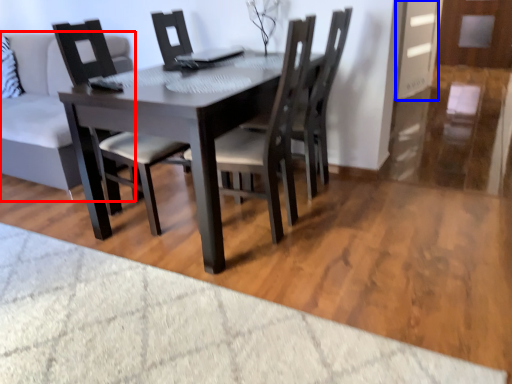
Question: Which of the following is the closest to the observer, studio couch (highlighted by a red box) or glass door (highlighted by a blue box)?

Choices:
 (A) studio couch
 (B) glass door

Answer: (A)